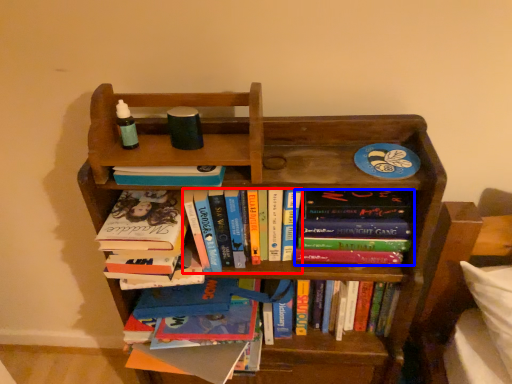
Question: Among these objects, which one is farthest to the camera, book (highlighted by a red box) or book (highlighted by a blue box)?

Choices:
 (A) book
 (B) book

Answer: (B)